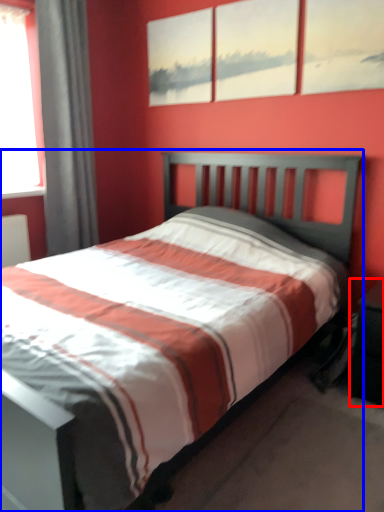
Question: Which object is further to the camera taking this photo, nightstand (highlighted by a red box) or bed (highlighted by a blue box)?

Choices:
 (A) nightstand
 (B) bed

Answer: (A)